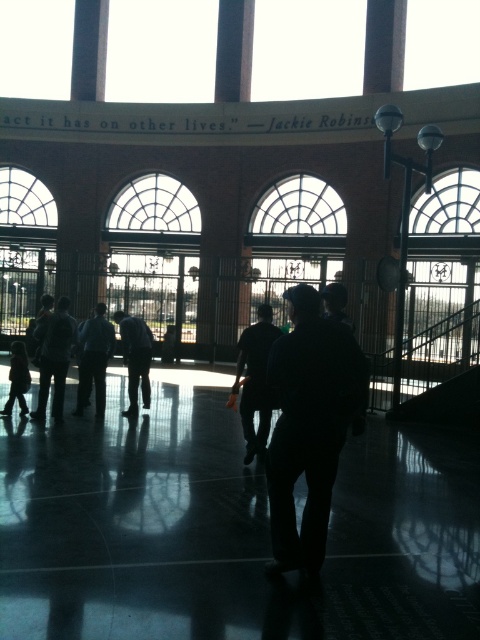
Does dark fabric jacket at center appear under dark gray suit at center?

Indeed, dark fabric jacket at center is positioned under dark gray suit at center.

Does point (345, 416) come in front of point (99, 307)?

Yes.

At what (x,y) coordinates should I click in order to perform the action: click on dark fabric jacket at center. Please return your answer as a coordinate pair (x, y). Looking at the image, I should click on (310, 426).

Locate an element on the screen. This screenshot has height=640, width=480. dark fabric jacket at center is located at coordinates (310, 426).

Between clear glass window at upper right and light pink fabric at lower left, which one appears on the left side from the viewer's perspective?

From the viewer's perspective, light pink fabric at lower left appears more on the left side.

Who is more distant from viewer, (x=415, y=212) or (x=16, y=385)?

The point (x=415, y=212) is more distant.

Who is more forward, (472, 195) or (0, 412)?

Point (0, 412) is more forward.

You are a GUI agent. You are given a task and a screenshot of the screen. Output one action in this format:
    pyautogui.click(x=<x>, y=<y>)
    Task: Click on the clear glass window at upper right
    
    Given the screenshot: What is the action you would take?
    pyautogui.click(x=447, y=204)

The image size is (480, 640). What do you see at coordinates (310, 426) in the screenshot?
I see `dark fabric jacket at center` at bounding box center [310, 426].

Is dark fabric jacket at center in front of dark gray jacket at center?

Yes, dark fabric jacket at center is closer to the viewer.

The height and width of the screenshot is (640, 480). I want to click on dark fabric jacket at center, so click(x=310, y=426).